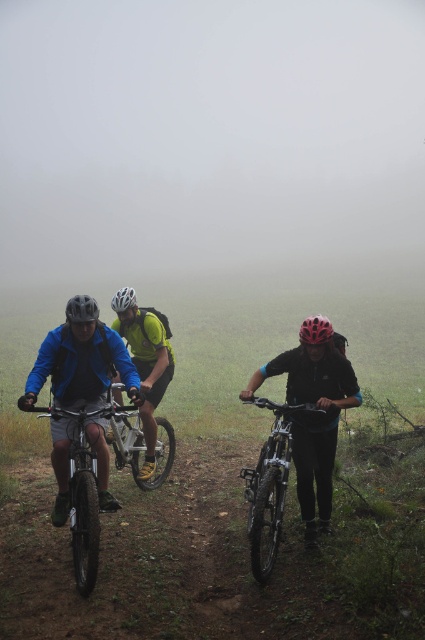
Question: Estimate the real-world distances between objects in this image. Which object is farther from the foggy mist at center?

Choices:
 (A) black matte helmet at center
 (B) matte yellow helmet at center
 (C) matte black bicycle at center

Answer: (B)

Question: Is matte black helmet at left bigger than matte yellow helmet at center?

Choices:
 (A) no
 (B) yes

Answer: (A)

Question: Which of the following is the farthest from the observer?

Choices:
 (A) (68, 300)
 (B) (78, 476)
 (C) (252, 484)

Answer: (A)

Question: Is the position of foggy mist at center more distant than that of matte black helmet at left?

Choices:
 (A) yes
 (B) no

Answer: (A)

Question: Can you confirm if black matte helmet at center is thinner than matte black helmet at center?

Choices:
 (A) no
 (B) yes

Answer: (A)

Question: Which object appears farthest from the camera in this image?

Choices:
 (A) silver metallic bicycle at center
 (B) foggy mist at center

Answer: (B)